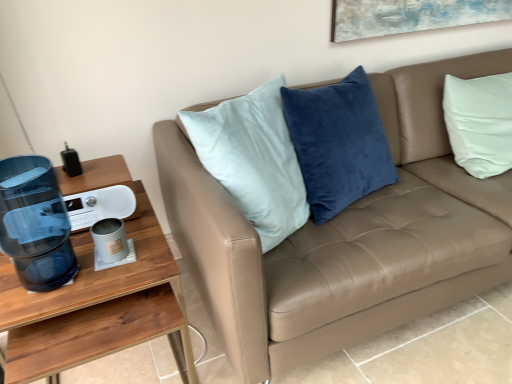
Question: From the image's perspective, does matte gray mug at lower left appear higher than transparent plastic water cooler at left?

Choices:
 (A) yes
 (B) no

Answer: (B)

Question: Considering the relative sizes of matte gray mug at lower left and transparent plastic water cooler at left in the image provided, is matte gray mug at lower left bigger than transparent plastic water cooler at left?

Choices:
 (A) no
 (B) yes

Answer: (A)

Question: Considering the relative positions of matte gray mug at lower left and transparent plastic water cooler at left in the image provided, is matte gray mug at lower left to the left of transparent plastic water cooler at left from the viewer's perspective?

Choices:
 (A) no
 (B) yes

Answer: (A)

Question: Considering the relative sizes of matte gray mug at lower left and transparent plastic water cooler at left in the image provided, is matte gray mug at lower left thinner than transparent plastic water cooler at left?

Choices:
 (A) yes
 (B) no

Answer: (A)

Question: From a real-world perspective, is matte gray mug at lower left positioned over transparent plastic water cooler at left based on gravity?

Choices:
 (A) no
 (B) yes

Answer: (A)

Question: From a real-world perspective, is wooden desk at left physically located above or below transparent plastic water cooler at left?

Choices:
 (A) below
 (B) above

Answer: (A)

Question: Based on their sizes in the image, would you say wooden desk at left is bigger or smaller than transparent plastic water cooler at left?

Choices:
 (A) small
 (B) big

Answer: (B)

Question: Is wooden desk at left inside the boundaries of transparent plastic water cooler at left, or outside?

Choices:
 (A) outside
 (B) inside

Answer: (A)

Question: From the image's perspective, relative to transparent plastic water cooler at left, is wooden desk at left above or below?

Choices:
 (A) below
 (B) above

Answer: (A)

Question: Is transparent plastic water cooler at left wider or thinner than wooden desk at left?

Choices:
 (A) thin
 (B) wide

Answer: (A)

Question: Is transparent plastic water cooler at left bigger or smaller than wooden desk at left?

Choices:
 (A) big
 (B) small

Answer: (B)

Question: Choose the correct answer: Is transparent plastic water cooler at left inside wooden desk at left or outside it?

Choices:
 (A) outside
 (B) inside

Answer: (A)

Question: Is point (41, 183) closer or farther from the camera than point (134, 296)?

Choices:
 (A) closer
 (B) farther

Answer: (B)

Question: Considering the positions of matte gray mug at lower left and wooden desk at left in the image, is matte gray mug at lower left taller or shorter than wooden desk at left?

Choices:
 (A) short
 (B) tall

Answer: (A)

Question: In terms of width, does matte gray mug at lower left look wider or thinner when compared to wooden desk at left?

Choices:
 (A) thin
 (B) wide

Answer: (A)